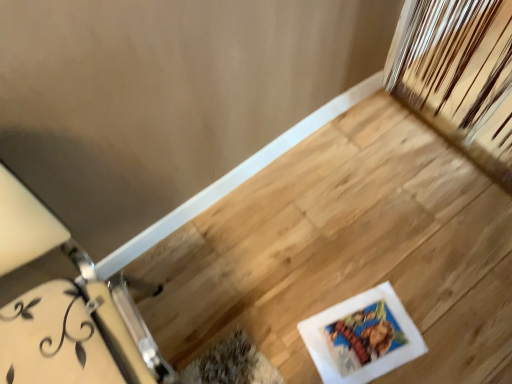
Image resolution: width=512 pixels, height=384 pixels. Find the location of `unoccupied space behind white glossy picture frame at lower right`. unoccupied space behind white glossy picture frame at lower right is located at coordinates (345, 245).